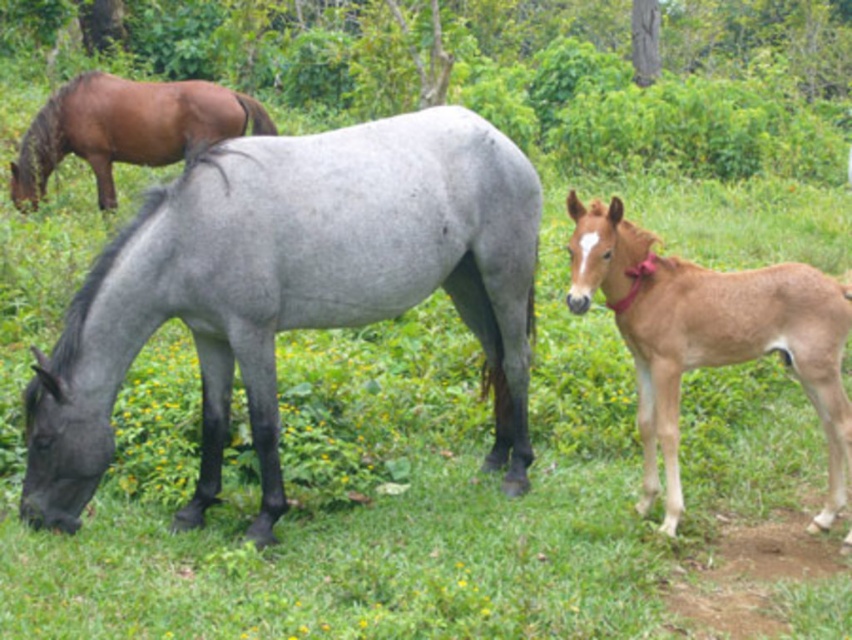
You are a farmer checking the field. You need to know if the gray matte horse at center can fit through a gate that is exactly the width of the brown smooth foal at right. Can it?

Result: The gray matte horse at center is wider than the brown smooth foal at right, so it cannot fit through the gate that is exactly the width of the brown smooth foal at right.

Based on the photo, you are a farmer standing in the field and want to lead the gray matte horse at center to the barn located behind the brown glossy horse at upper left. Which direction should you walk to move the horse towards the barn?

The gray matte horse at center is below the brown glossy horse at upper left, so to move it towards the barn behind the brown glossy horse at upper left, you should walk northward to guide the horse upward.